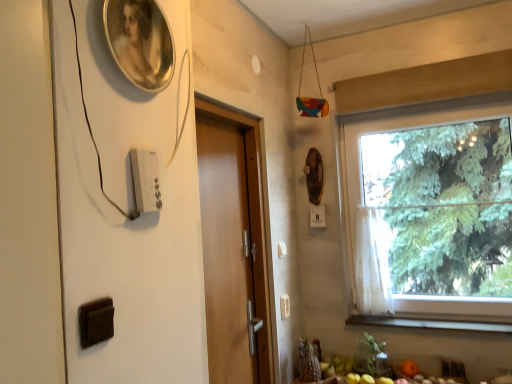
Question: From the image's perspective, is white sheer curtain at window located beneath wooden door at center?

Choices:
 (A) no
 (B) yes

Answer: (B)

Question: Does white sheer curtain at window have a larger size compared to wooden door at center?

Choices:
 (A) yes
 (B) no

Answer: (B)

Question: Does white sheer curtain at window have a lesser width compared to wooden door at center?

Choices:
 (A) yes
 (B) no

Answer: (B)

Question: Does white sheer curtain at window turn towards wooden door at center?

Choices:
 (A) yes
 (B) no

Answer: (B)

Question: Does white sheer curtain at window come behind wooden door at center?

Choices:
 (A) no
 (B) yes

Answer: (B)

Question: From a real-world perspective, is white sheer curtain at window on wooden door at center?

Choices:
 (A) yes
 (B) no

Answer: (B)

Question: Considering the relative sizes of white sheer curtain at window and white plastic light switch at upper left, the 1th light switch from the left, in the image provided, is white sheer curtain at window taller than white plastic light switch at upper left, the 1th light switch from the left,?

Choices:
 (A) yes
 (B) no

Answer: (A)

Question: Is white plastic light switch at upper left, acting as the third light switch starting from the right, a part of white sheer curtain at window?

Choices:
 (A) no
 (B) yes

Answer: (A)

Question: Considering the relative sizes of white sheer curtain at window and white plastic light switch at upper left, positioned as the third light switch in bottom-to-top order, in the image provided, is white sheer curtain at window wider than white plastic light switch at upper left, positioned as the third light switch in bottom-to-top order,?

Choices:
 (A) no
 (B) yes

Answer: (B)

Question: Can you see white sheer curtain at window touching white plastic light switch at upper left, acting as the 1th light switch starting from the top?

Choices:
 (A) yes
 (B) no

Answer: (B)

Question: Is white sheer curtain at window positioned with its back to white plastic light switch at upper left, acting as the third light switch starting from the back?

Choices:
 (A) yes
 (B) no

Answer: (B)

Question: From the image's perspective, is white sheer curtain at window located beneath white plastic light switch at upper left, the first light switch in the front-to-back sequence?

Choices:
 (A) no
 (B) yes

Answer: (B)

Question: Is wooden at lower right further to camera compared to wooden door at center?

Choices:
 (A) no
 (B) yes

Answer: (B)